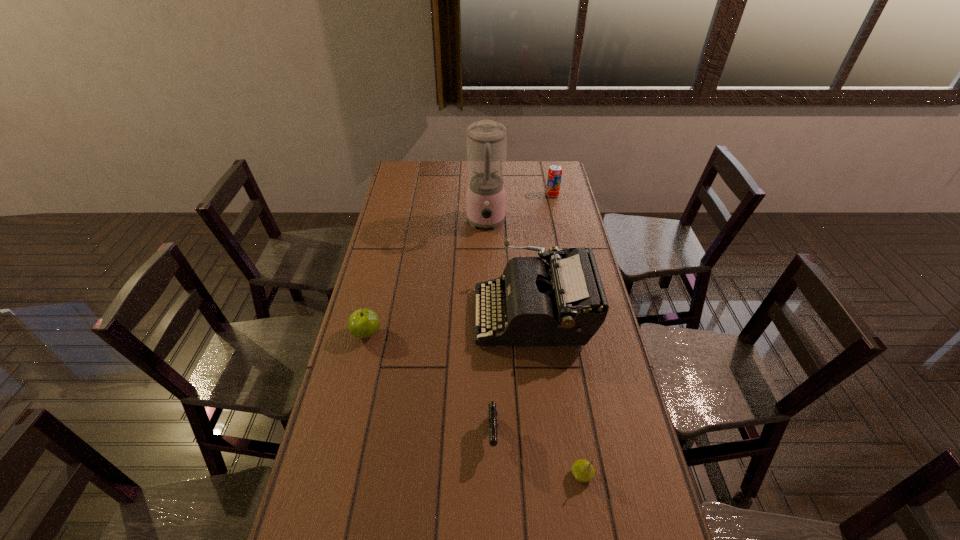
I want to click on the tallest object, so click(x=486, y=140).

In order to click on the second farthest object in this screenshot , I will do `click(486, 140)`.

Identify the location of typewriter. (564, 303).

You are a GUI agent. You are given a task and a screenshot of the screen. Output one action in this format:
    pyautogui.click(x=<x>, y=<y>)
    Task: Click on the farthest object
    Image resolution: width=960 pixels, height=540 pixels.
    Given the screenshot: What is the action you would take?
    pyautogui.click(x=555, y=171)

Locate an element on the screen. Image resolution: width=960 pixels, height=540 pixels. the fourth shortest object is located at coordinates (555, 171).

The image size is (960, 540). I want to click on the fourth tallest object, so click(363, 323).

You are a GUI agent. You are given a task and a screenshot of the screen. Output one action in this format:
    pyautogui.click(x=<x>, y=<y>)
    Task: Click on the apple
    
    Given the screenshot: What is the action you would take?
    pyautogui.click(x=363, y=323)

Find the location of `the second nearest object`. the second nearest object is located at coordinates (492, 417).

At what (x,y) coordinates should I click in order to perform the action: click on the nearest object. Please return your answer as a coordinate pair (x, y). Looking at the image, I should click on (583, 471).

I want to click on free space located 0.210m on the base of the tallest object near the control knob, so click(487, 271).